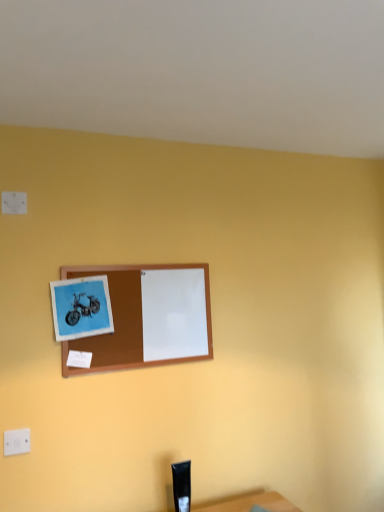
Question: Is point (130, 273) closer or farther from the camera than point (6, 443)?

Choices:
 (A) closer
 (B) farther

Answer: (B)

Question: Based on their positions, is brown wooden picture frame at center located to the left or right of white plastic electric outlet at lower left?

Choices:
 (A) left
 (B) right

Answer: (B)

Question: From a real-world perspective, is brown wooden picture frame at center positioned above or below white plastic electric outlet at lower left?

Choices:
 (A) below
 (B) above

Answer: (B)

Question: From their relative heights in the image, would you say white plastic electric outlet at lower left is taller or shorter than brown wooden picture frame at center?

Choices:
 (A) tall
 (B) short

Answer: (B)

Question: Relative to brown wooden picture frame at center, is white plastic electric outlet at lower left in front or behind?

Choices:
 (A) behind
 (B) front

Answer: (B)

Question: Is point (23, 435) closer or farther from the camera than point (119, 346)?

Choices:
 (A) closer
 (B) farther

Answer: (A)

Question: Is white plastic electric outlet at lower left to the left or to the right of brown wooden picture frame at center in the image?

Choices:
 (A) left
 (B) right

Answer: (A)